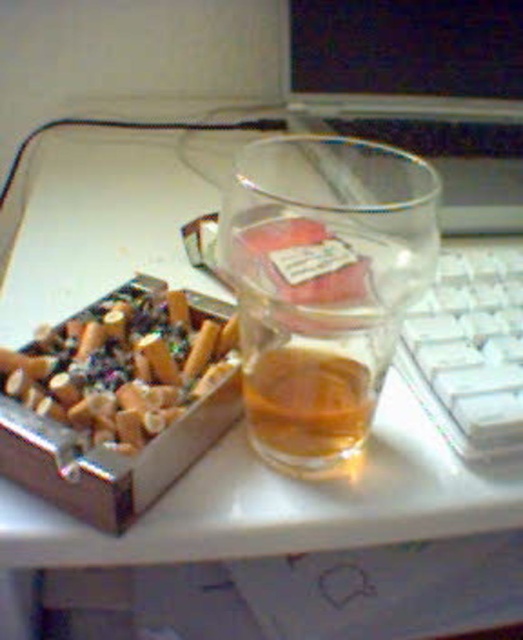
You are organizing items on a desk and need to place the transparent glass at center and the white plastic keyboard at right. Which item has a greater height?

The transparent glass at center is taller than the white plastic keyboard at right.

You are looking at the desk setup and need to determine which of the two points, point (262, 141) or point (496, 259), is closer to you. Which one is closer?

Point (262, 141) is closer to the camera than point (496, 259).

You are organizing the desk and want to place a decorative item on the translucent glass at center. However, you notice the white plastic keyboard at right is currently covering part of it. Is the keyboard blocking the entire surface of the glass?

The white plastic keyboard at right is positioned over translucent glass at center, so the keyboard is blocking part of the glass surface but not the entire area.